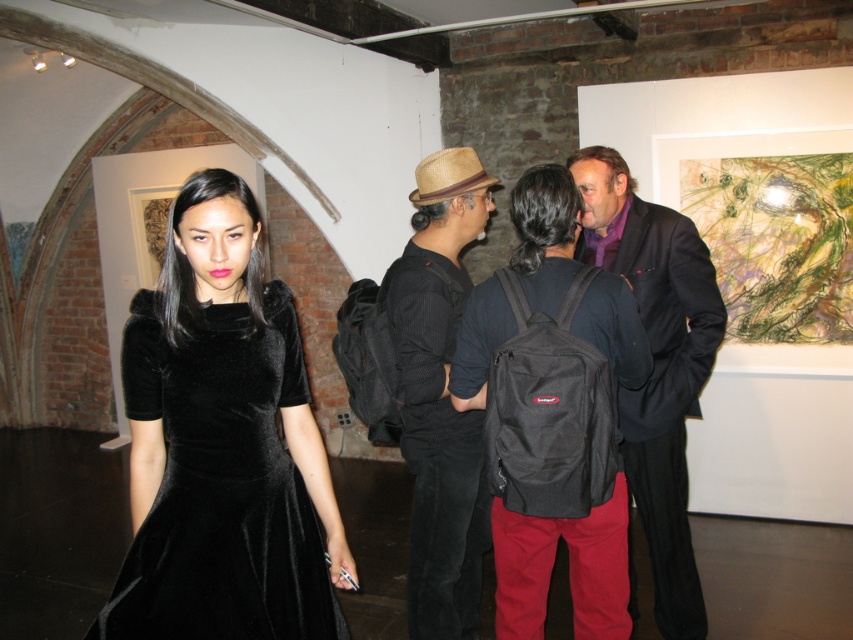
Who is more distant from viewer, (289, 458) or (447, 184)?

The point (447, 184) is behind.

I want to click on velvet black dress at left, so click(x=221, y=484).

Is black velvet dress at center bigger than velvet black dress at left?

Yes, black velvet dress at center is bigger than velvet black dress at left.

Who is more distant from viewer, [583,429] or [177,586]?

Positioned behind is point [583,429].

You are a GUI agent. You are given a task and a screenshot of the screen. Output one action in this format:
    pyautogui.click(x=<x>, y=<y>)
    Task: Click on the black velvet dress at center
    The image size is (853, 640).
    Given the screenshot: What is the action you would take?
    pyautogui.click(x=552, y=413)

Does velvet black dress at left have a lesser height compared to dark suit at center?

Correct, velvet black dress at left is not as tall as dark suit at center.

Can you confirm if velvet black dress at left is positioned to the left of dark suit at center?

Yes, velvet black dress at left is to the left of dark suit at center.

Identify the location of velvet black dress at left. (221, 484).